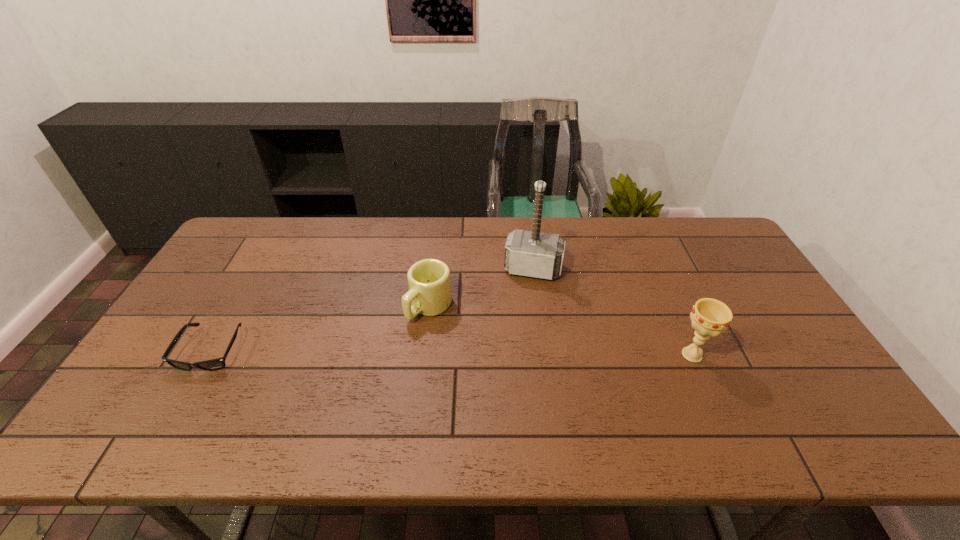
The height and width of the screenshot is (540, 960). I want to click on the shortest object, so click(x=214, y=364).

Identify the location of sunglasses. (214, 364).

Identify the location of the third shortest object. Image resolution: width=960 pixels, height=540 pixels. (710, 317).

What are the coordinates of `chalice` in the screenshot? It's located at (710, 317).

I want to click on the farthest object, so click(527, 253).

You are a GUI agent. You are given a task and a screenshot of the screen. Output one action in this format:
    pyautogui.click(x=<x>, y=<y>)
    Task: Click on the hammer
    This screenshot has width=960, height=540.
    Given the screenshot: What is the action you would take?
    pyautogui.click(x=527, y=253)

Where is `the third tallest object`? The image size is (960, 540). the third tallest object is located at coordinates (429, 281).

Where is `the second farthest object`? The image size is (960, 540). the second farthest object is located at coordinates (429, 281).

Find the location of a particular element. vacant region located 0.060m on the front-facing side of the sunglasses is located at coordinates (186, 395).

Find the location of a particular element. Image resolution: width=960 pixels, height=540 pixels. vacant space located 0.360m on the back of the second tallest object is located at coordinates (649, 258).